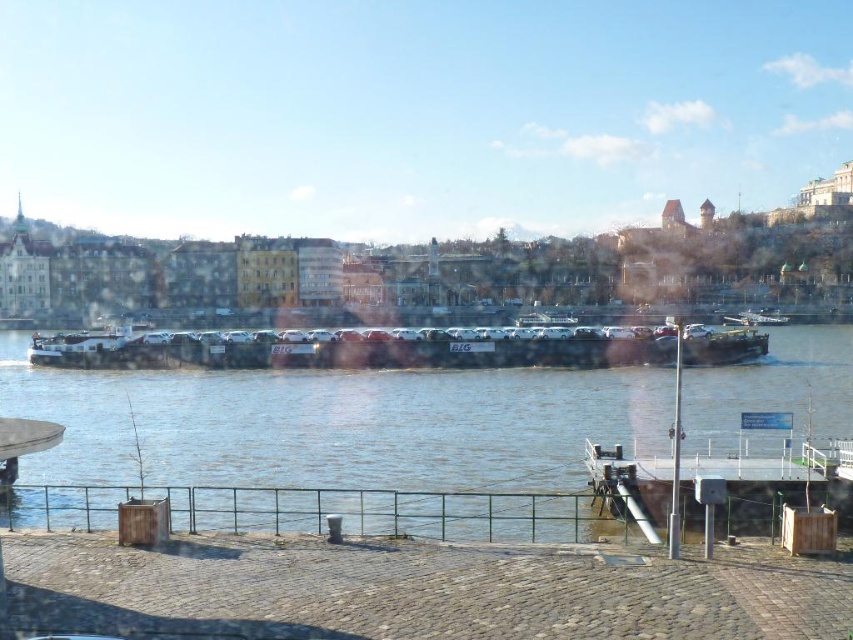
Can you confirm if brown matte water at center is thinner than metallic gray barge at center?

No.

Does brown matte water at center lie in front of metallic gray barge at center?

That is True.

What do you see at coordinates (334, 422) in the screenshot? I see `brown matte water at center` at bounding box center [334, 422].

Identify the location of brown matte water at center. The width and height of the screenshot is (853, 640). (334, 422).